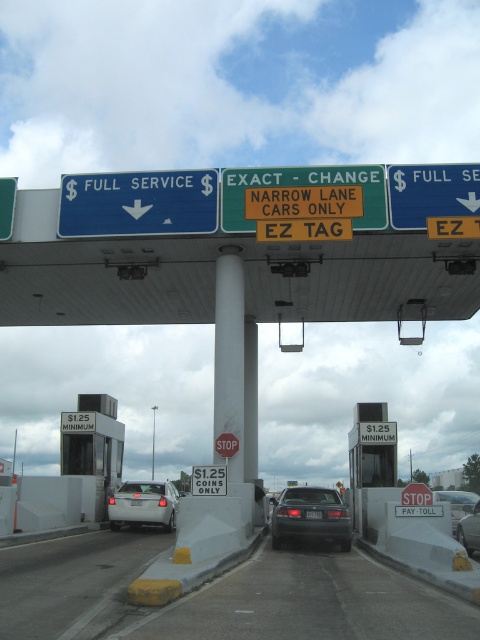
Question: Which of the following is the farthest from the observer?

Choices:
 (A) (155, 515)
 (B) (374, 177)
 (C) (320, 516)

Answer: (A)

Question: Which object appears closest to the camera in this image?

Choices:
 (A) white concrete pole at center
 (B) white glossy pillar at center
 (C) stop sign at center

Answer: (C)

Question: Is black glossy sedan at center behind black plastic license plate at center?

Choices:
 (A) no
 (B) yes

Answer: (A)

Question: Which of the following is the closest to the observer?

Choices:
 (A) blue metallic sign at upper center
 (B) blue metallic sign at upper right

Answer: (B)

Question: Does yellow rubber curb at lower center appear on the left side of greenmaterial/texturesign at center?

Choices:
 (A) yes
 (B) no

Answer: (A)

Question: Does white glossy pillar at center come in front of white concrete pole at center?

Choices:
 (A) yes
 (B) no

Answer: (A)